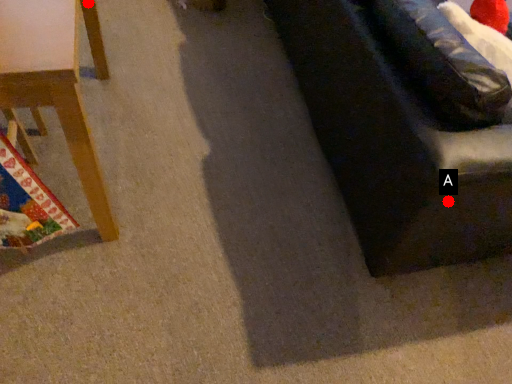
Question: Two points are circled on the image, labeled by A and B beside each circle. Which point appears farthest from the camera in this image?

Choices:
 (A) A is further
 (B) B is further

Answer: (B)